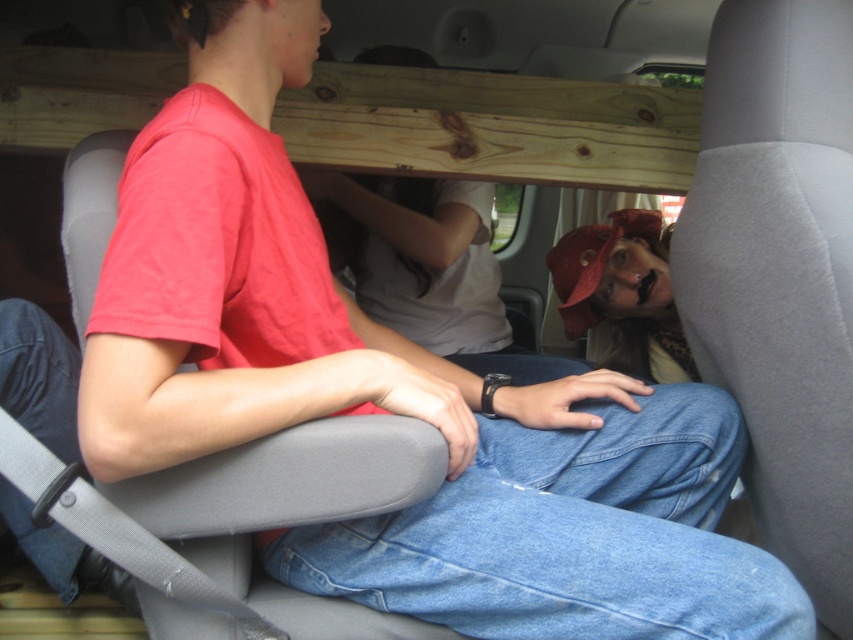
Consider the image. Between matte red cap at center and blue denim jeans at lower left, which one appears on the left side from the viewer's perspective?

blue denim jeans at lower left

Can you confirm if matte red cap at center is positioned above blue denim jeans at lower left?

Yes, matte red cap at center is above blue denim jeans at lower left.

Is point (560, 266) positioned behind point (39, 410)?

Yes, point (560, 266) is behind point (39, 410).

You are a GUI agent. You are given a task and a screenshot of the screen. Output one action in this format:
    pyautogui.click(x=<x>, y=<y>)
    Task: Click on the matte red cap at center
    The image size is (853, 640).
    Given the screenshot: What is the action you would take?
    pyautogui.click(x=624, y=292)

Does point (495, 506) come closer to viewer compared to point (598, 253)?

Yes, point (495, 506) is in front of point (598, 253).

Does point (698, 396) come farther from viewer compared to point (662, 285)?

No, (698, 396) is closer to viewer.

This screenshot has width=853, height=640. Identify the location of denim at center. 569,536.

Where is `denim at center`? denim at center is located at coordinates (569, 536).

Between denim at center and blue denim jeans at lower left, which one has more height?

With more height is blue denim jeans at lower left.

Does point (488, 502) come behind point (41, 339)?

That is False.

Identify the location of denim at center. Image resolution: width=853 pixels, height=640 pixels. (569, 536).